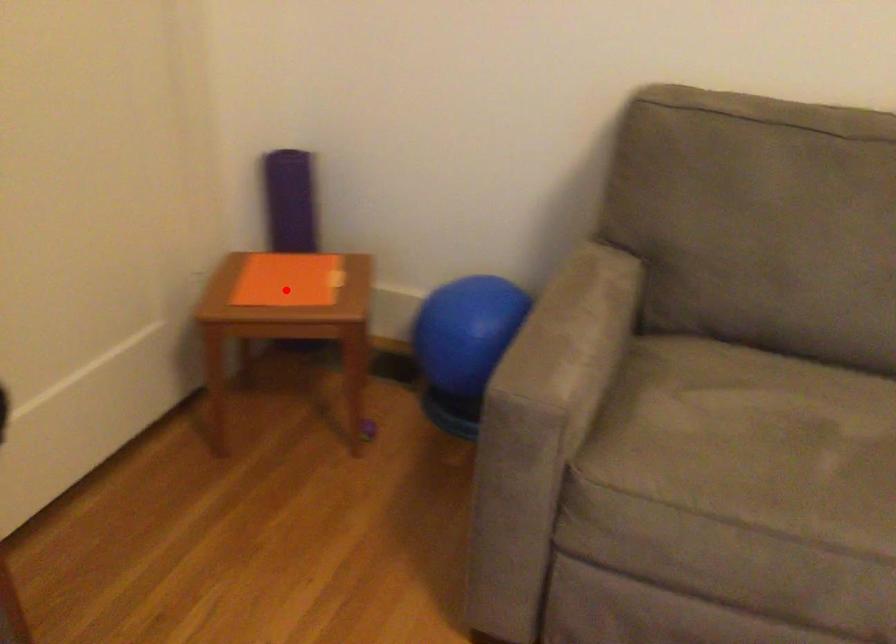
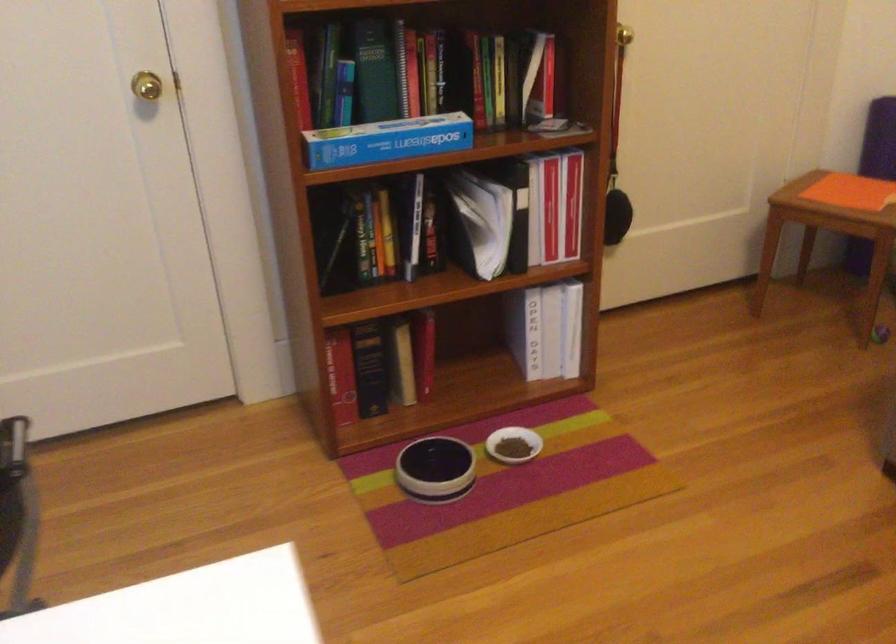
Question: I am providing you with two images of the same scene from different viewpoints. Image1 has a red point marked. In image2, the corresponding 3D location appears at what relative position? Reply with the corresponding letter.

Choices:
 (A) Closer
 (B) Farther

Answer: (B)